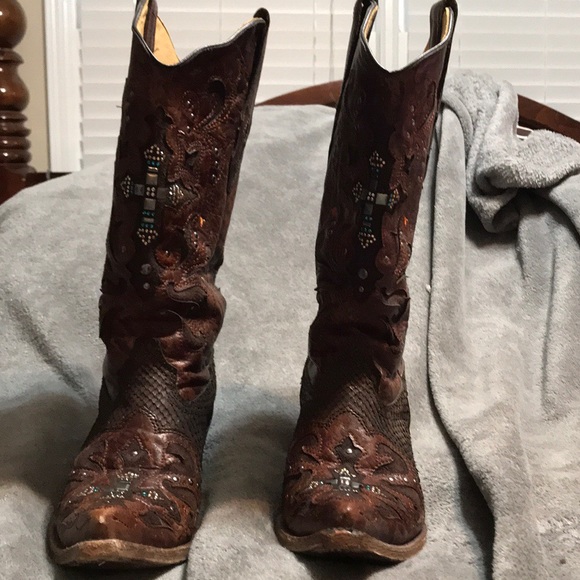
Locate an element on the screen. wall is located at coordinates (27, 72).